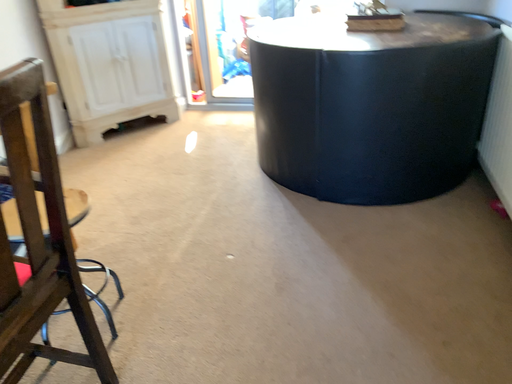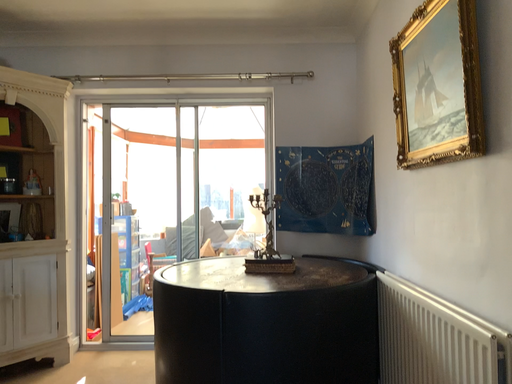
Question: How did the camera likely rotate when shooting the video?

Choices:
 (A) rotated left
 (B) rotated right

Answer: (B)